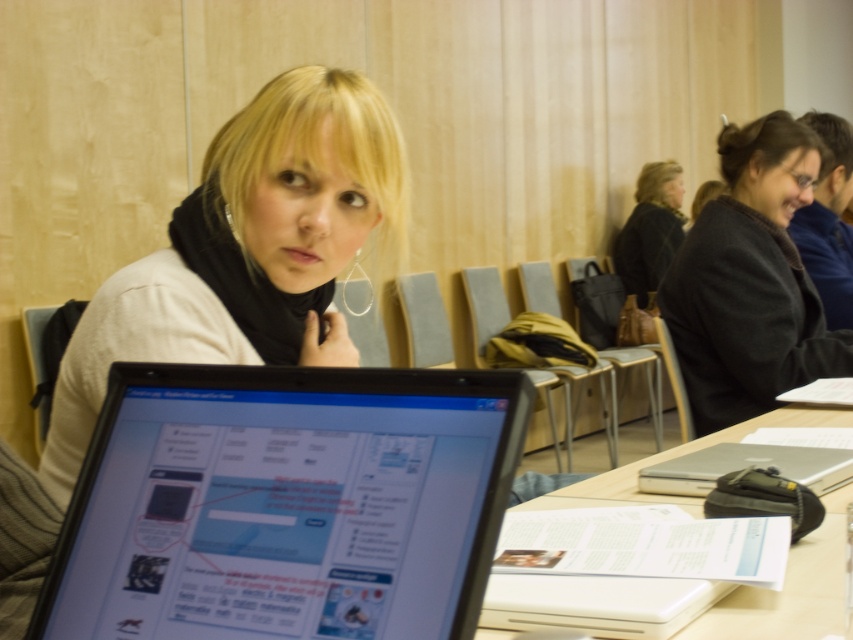
Can you confirm if white paper at center is bigger than black fabric jacket at upper right?

No.

Which is more to the left, white paper at center or black fabric jacket at upper right?

Positioned to the left is white paper at center.

Image resolution: width=853 pixels, height=640 pixels. Find the location of `white paper at center`. white paper at center is located at coordinates (791, 593).

The image size is (853, 640). I want to click on white paper at center, so click(791, 593).

Is shiny black laptop at center behind dark gray wool coat at center?

No, shiny black laptop at center is in front of dark gray wool coat at center.

Is shiny black laptop at center bigger than dark gray wool coat at center?

No.

This screenshot has height=640, width=853. In order to click on shiny black laptop at center in this screenshot , I will do `click(286, 502)`.

At what (x,y) coordinates should I click in order to perform the action: click on shiny black laptop at center. Please return your answer as a coordinate pair (x, y). This screenshot has height=640, width=853. Looking at the image, I should click on (286, 502).

Does shiny black laptop at center appear on the right side of white paper at center?

Incorrect, shiny black laptop at center is not on the right side of white paper at center.

Locate an element on the screen. The width and height of the screenshot is (853, 640). shiny black laptop at center is located at coordinates (286, 502).

Locate an element on the screen. This screenshot has width=853, height=640. shiny black laptop at center is located at coordinates (286, 502).